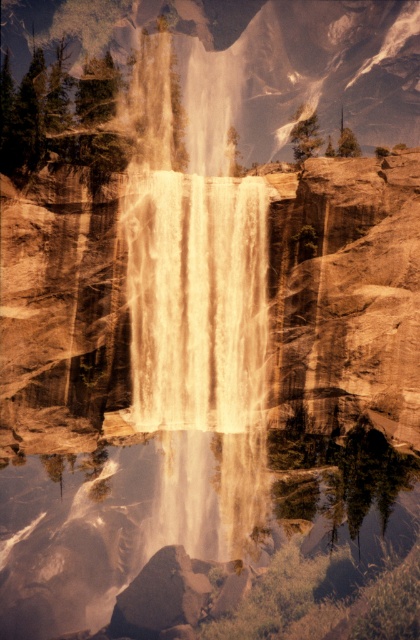
You are standing at the base of the waterfall and want to take a photo that includes both the point at coordinates point [356,480] and point [165,218]. Which point should you position closer to the camera to ensure both are visible in the frame?

To ensure both points are visible in the frame, you should position the camera closer to point [165,218] because point [356,480] is behind it. This way, the foreground point will be in focus while still capturing the background point within the frame.

You are a photographer trying to capture the waterfall. You notice two types of water in the scene. Which one, the translucent water at center or the white frothy water at center, is higher up in the waterfall?

The white frothy water at center is higher up than the translucent water at center because the translucent water at center has a lesser height compared to white frothy water at center.